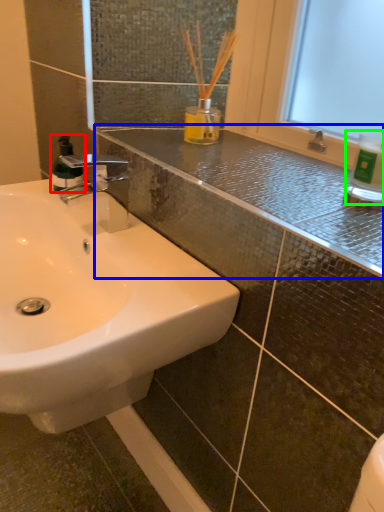
Question: Based on their relative distances, which object is nearer to mouthwash (highlighted by a red box)? Choose from counter top (highlighted by a blue box) and bottle (highlighted by a green box).

Choices:
 (A) counter top
 (B) bottle

Answer: (A)